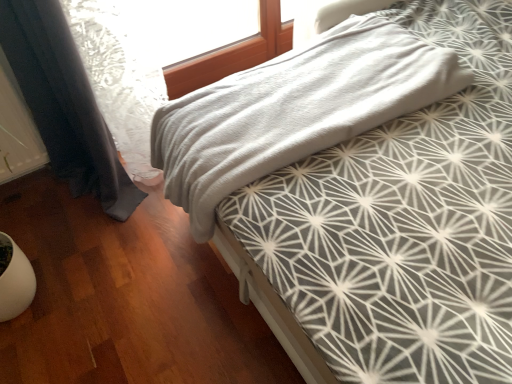
Question: From the image's perspective, is gray soft fabric bed at center positioned above or below dark blue fabric curtain at left?

Choices:
 (A) below
 (B) above

Answer: (B)

Question: From a real-world perspective, is gray soft fabric bed at center positioned above or below dark blue fabric curtain at left?

Choices:
 (A) above
 (B) below

Answer: (B)

Question: From their relative heights in the image, would you say gray soft fabric bed at center is taller or shorter than dark blue fabric curtain at left?

Choices:
 (A) tall
 (B) short

Answer: (B)

Question: From a real-world perspective, is dark blue fabric curtain at left positioned above or below gray soft fabric bed at center?

Choices:
 (A) below
 (B) above

Answer: (B)

Question: Relative to gray soft fabric bed at center, is dark blue fabric curtain at left in front or behind?

Choices:
 (A) behind
 (B) front

Answer: (B)

Question: Is point pos(30,33) positioned closer to the camera than point pos(494,276)?

Choices:
 (A) farther
 (B) closer

Answer: (A)

Question: Would you say dark blue fabric curtain at left is to the left or to the right of gray soft fabric bed at center in the picture?

Choices:
 (A) left
 (B) right

Answer: (A)